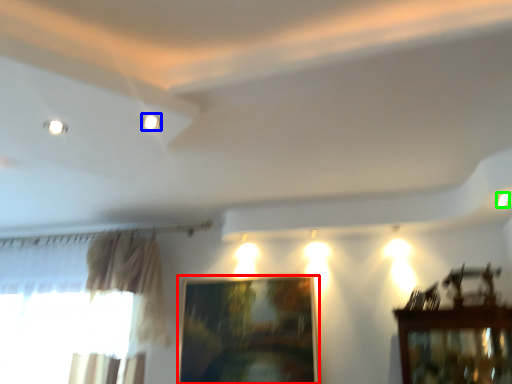
Question: Which is farther away from picture frame (highlighted by a red box)? lighting (highlighted by a blue box) or light (highlighted by a green box)?

Choices:
 (A) lighting
 (B) light

Answer: (A)